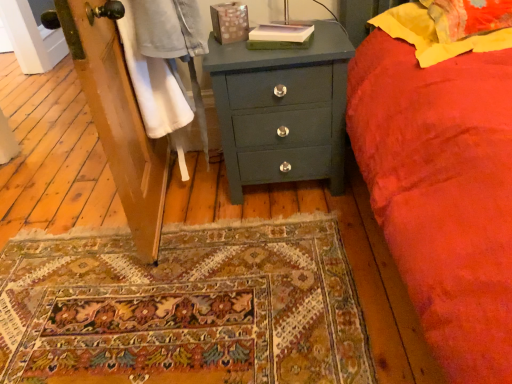
Question: Considering the positions of yellow fabric pillow at upper right, which is the first pillow from top to bottom, and yellow fabric pillow at upper right, which appears as the 1th pillow when ordered from the bottom, in the image, is yellow fabric pillow at upper right, which is the first pillow from top to bottom, taller or shorter than yellow fabric pillow at upper right, which appears as the 1th pillow when ordered from the bottom,?

Choices:
 (A) tall
 (B) short

Answer: (A)

Question: Is yellow fabric pillow at upper right, arranged as the second pillow when ordered from the bottom, in front of or behind yellow fabric pillow at upper right, which appears as the 1th pillow when ordered from the bottom, in the image?

Choices:
 (A) front
 (B) behind

Answer: (B)

Question: Which is farther from the matte green chest of drawers at center?

Choices:
 (A) yellow fabric pillow at upper right, which is the first pillow from top to bottom
 (B) yellow fabric pillow at upper right, the 2th pillow viewed from the top

Answer: (A)

Question: Which object is the farthest from the yellow fabric pillow at upper right, arranged as the second pillow when ordered from the bottom?

Choices:
 (A) matte green chest of drawers at center
 (B) yellow fabric pillow at upper right, which appears as the 1th pillow when ordered from the bottom

Answer: (A)